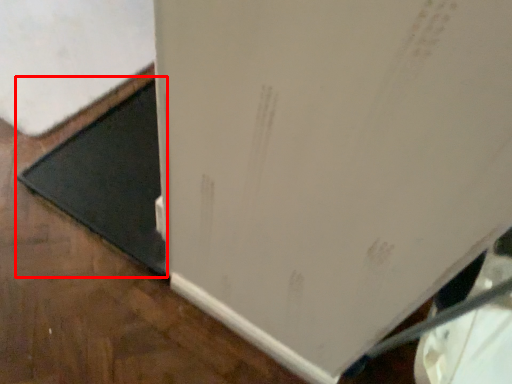
Question: Considering the relative positions of doormat (annotated by the red box) and refrigerator in the image provided, where is doormat (annotated by the red box) located with respect to the staircase?

Choices:
 (A) left
 (B) right

Answer: (B)